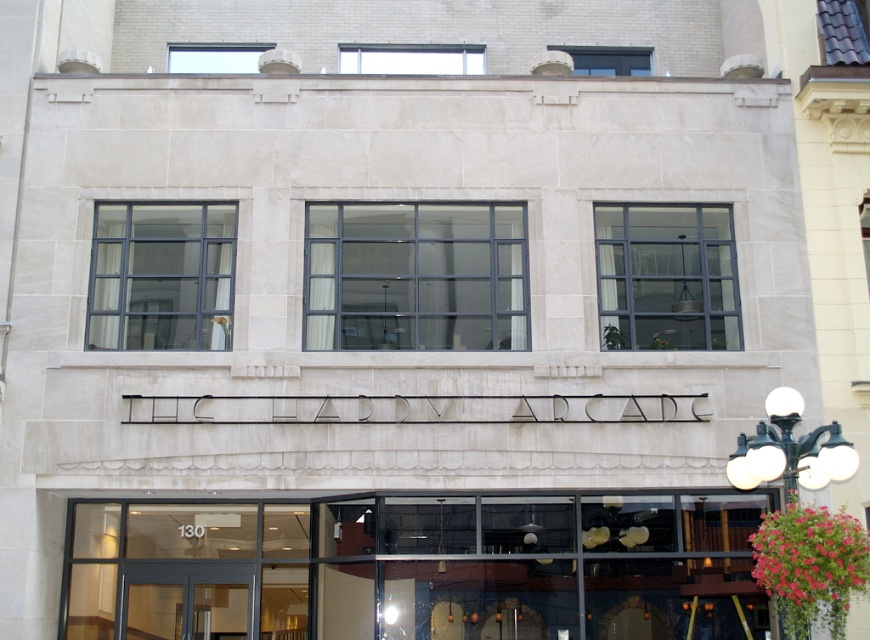
You are a delivery person trying to enter the building with a tall package that is 2 meters in height. The package must remain upright. You see the clear glass doors at lower center and the clear glass door at lower center. Which door can the package fit through without tilting?

The clear glass doors at lower center is much taller than the clear glass door at lower center, so the package can fit through the clear glass doors at lower center without tilting.

You are a delivery person approaching the entrance of The Hardy Arcade. You see the clear glass door at lower center and the black metal streetlamp at upper right. Which object is positioned higher up on the building?

The black metal streetlamp at upper right is positioned higher up on the building than the clear glass door at lower center.